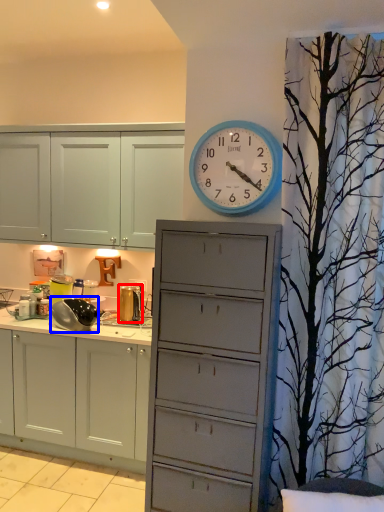
Question: Which point is further to the camera, appliance (highlighted by a red box) or appliance (highlighted by a blue box)?

Choices:
 (A) appliance
 (B) appliance

Answer: (A)